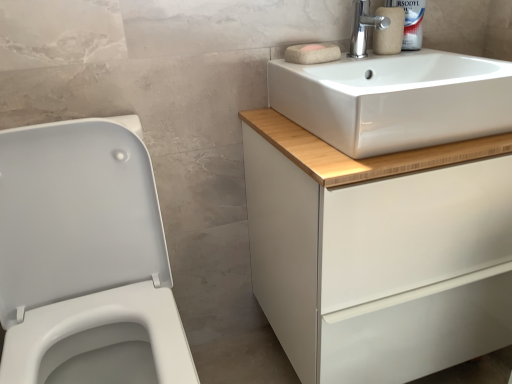
Question: Does white glossy porcelain at left appear on the right side of natural wool soap at upper center, positioned as the 1th soap in front-to-back order?

Choices:
 (A) yes
 (B) no

Answer: (B)

Question: Is white glossy porcelain at left next to natural wool soap at upper center, positioned as the 1th soap in front-to-back order, and touching it?

Choices:
 (A) yes
 (B) no

Answer: (B)

Question: Is white glossy porcelain at left wider than natural wool soap at upper center, positioned as the 1th soap in front-to-back order?

Choices:
 (A) no
 (B) yes

Answer: (B)

Question: Considering the relative sizes of white glossy porcelain at left and natural wool soap at upper center, positioned as the 1th soap in front-to-back order, in the image provided, is white glossy porcelain at left shorter than natural wool soap at upper center, positioned as the 1th soap in front-to-back order,?

Choices:
 (A) yes
 (B) no

Answer: (B)

Question: Are white glossy porcelain at left and natural wool soap at upper center, which ranks as the 2th soap in back-to-front order, located far from each other?

Choices:
 (A) yes
 (B) no

Answer: (B)

Question: From the image's perspective, is white glossy porcelain at left located above natural wool soap at upper center, positioned as the 1th soap in front-to-back order?

Choices:
 (A) no
 (B) yes

Answer: (A)

Question: Is polished chrome tap at upper right aimed at matte beige toilet paper at upper right?

Choices:
 (A) yes
 (B) no

Answer: (B)

Question: Does polished chrome tap at upper right have a lesser width compared to matte beige toilet paper at upper right?

Choices:
 (A) no
 (B) yes

Answer: (B)

Question: Does polished chrome tap at upper right contain matte beige toilet paper at upper right?

Choices:
 (A) yes
 (B) no

Answer: (B)

Question: From the image's perspective, is polished chrome tap at upper right located beneath matte beige toilet paper at upper right?

Choices:
 (A) no
 (B) yes

Answer: (B)

Question: Is polished chrome tap at upper right shorter than matte beige toilet paper at upper right?

Choices:
 (A) yes
 (B) no

Answer: (B)

Question: Is polished chrome tap at upper right facing away from matte beige toilet paper at upper right?

Choices:
 (A) yes
 (B) no

Answer: (B)

Question: From a real-world perspective, does polished chrome tap at upper right sit lower than white matte cabinet at upper right?

Choices:
 (A) yes
 (B) no

Answer: (B)